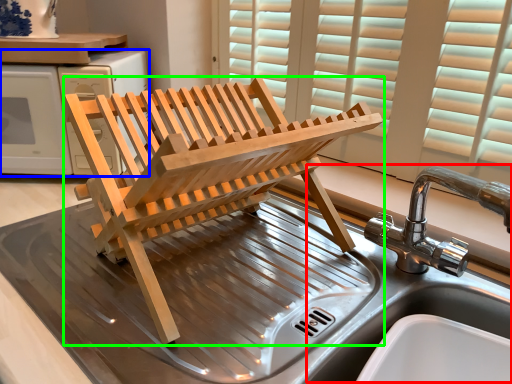
Question: Estimate the real-world distances between objects in this image. Which object is closer to sink (highlighted by a red box), appliance (highlighted by a blue box) or furniture (highlighted by a green box)?

Choices:
 (A) appliance
 (B) furniture

Answer: (B)